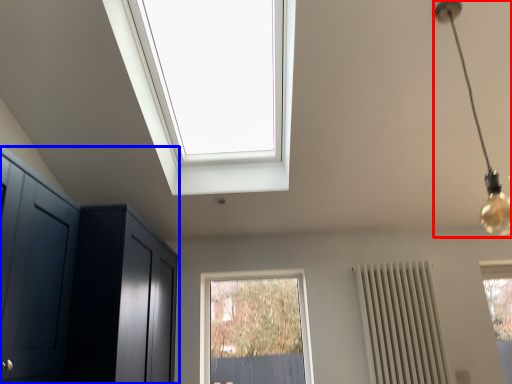
Question: Among these objects, which one is farthest to the camera, light fixture (highlighted by a red box) or dresser (highlighted by a blue box)?

Choices:
 (A) light fixture
 (B) dresser

Answer: (B)